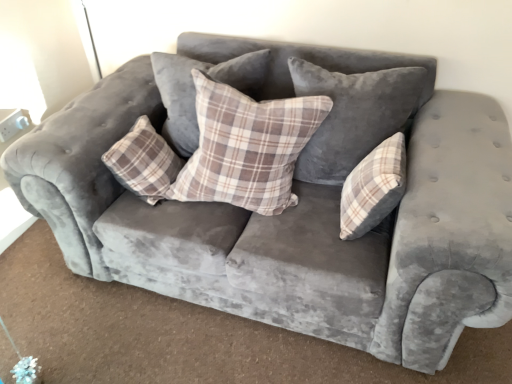
Question: Considering the relative sizes of plaid fabric pillow at center, which is counted as the 2th pillow, starting from the left, and plaid fabric pillow at center, which is the fourth pillow in left-to-right order, in the image provided, is plaid fabric pillow at center, which is counted as the 2th pillow, starting from the left, smaller than plaid fabric pillow at center, which is the fourth pillow in left-to-right order,?

Choices:
 (A) no
 (B) yes

Answer: (A)

Question: Is plaid fabric pillow at center, which is counted as the 2th pillow, starting from the left, oriented away from plaid fabric pillow at center, placed as the first pillow when sorted from right to left?

Choices:
 (A) yes
 (B) no

Answer: (B)

Question: Is plaid fabric pillow at center, which is the 3th pillow from right to left, outside of plaid fabric pillow at center, placed as the first pillow when sorted from right to left?

Choices:
 (A) yes
 (B) no

Answer: (A)

Question: Is plaid fabric pillow at center, which is the 3th pillow from right to left, closer to camera compared to plaid fabric pillow at center, which is the fourth pillow in left-to-right order?

Choices:
 (A) yes
 (B) no

Answer: (A)

Question: Is plaid fabric pillow at center, which is the 3th pillow from right to left, far from plaid fabric pillow at center, placed as the first pillow when sorted from right to left?

Choices:
 (A) no
 (B) yes

Answer: (A)

Question: Does plaid fabric pillow at center, which is the 3th pillow from right to left, appear on the left side of plaid fabric pillow at center, which is the fourth pillow in left-to-right order?

Choices:
 (A) yes
 (B) no

Answer: (A)

Question: Is plaid fabric pillow at center, which is the 3th pillow from right to left, placed right next to velvet plaid pillow at center, the third pillow when ordered from left to right?

Choices:
 (A) no
 (B) yes

Answer: (A)

Question: Considering the relative sizes of plaid fabric pillow at center, which is counted as the 2th pillow, starting from the left, and velvet plaid pillow at center, the third pillow when ordered from left to right, in the image provided, is plaid fabric pillow at center, which is counted as the 2th pillow, starting from the left, smaller than velvet plaid pillow at center, the third pillow when ordered from left to right,?

Choices:
 (A) yes
 (B) no

Answer: (B)

Question: Is plaid fabric pillow at center, which is the 3th pillow from right to left, at the left side of velvet plaid pillow at center, the third pillow when ordered from left to right?

Choices:
 (A) no
 (B) yes

Answer: (B)

Question: Does plaid fabric pillow at center, which is the 3th pillow from right to left, have a lesser width compared to velvet plaid pillow at center, the third pillow when ordered from left to right?

Choices:
 (A) no
 (B) yes

Answer: (B)

Question: From the image's perspective, would you say plaid fabric pillow at center, which is the 3th pillow from right to left, is positioned over velvet plaid pillow at center, the third pillow when ordered from left to right?

Choices:
 (A) yes
 (B) no

Answer: (B)

Question: From a real-world perspective, is plaid fabric pillow at center, which is counted as the 2th pillow, starting from the left, beneath velvet plaid pillow at center, the third pillow when ordered from left to right?

Choices:
 (A) yes
 (B) no

Answer: (A)

Question: From a real-world perspective, does plaid fabric pillow at center, arranged as the first pillow when viewed from the left, stand above plaid fabric pillow at center, placed as the first pillow when sorted from right to left?

Choices:
 (A) no
 (B) yes

Answer: (B)